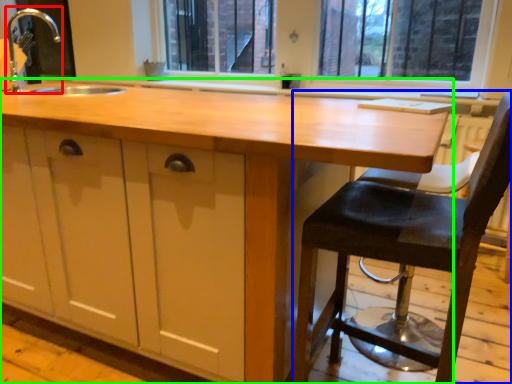
Question: Which object is the closest to the faucet (highlighted by a red box)? Choose among these: chair (highlighted by a blue box) or countertop (highlighted by a green box).

Choices:
 (A) chair
 (B) countertop

Answer: (B)